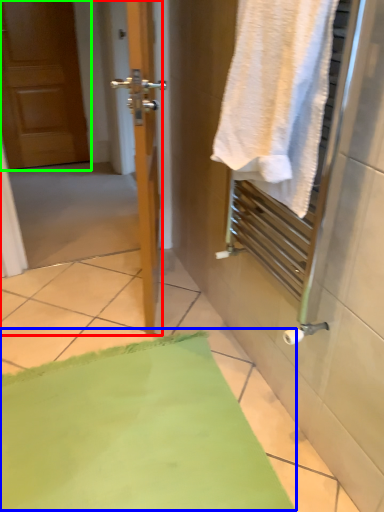
Question: Estimate the real-world distances between objects in this image. Which object is farther from screen door (highlighted by a red box), bath mat (highlighted by a blue box) or door (highlighted by a green box)?

Choices:
 (A) bath mat
 (B) door

Answer: (B)